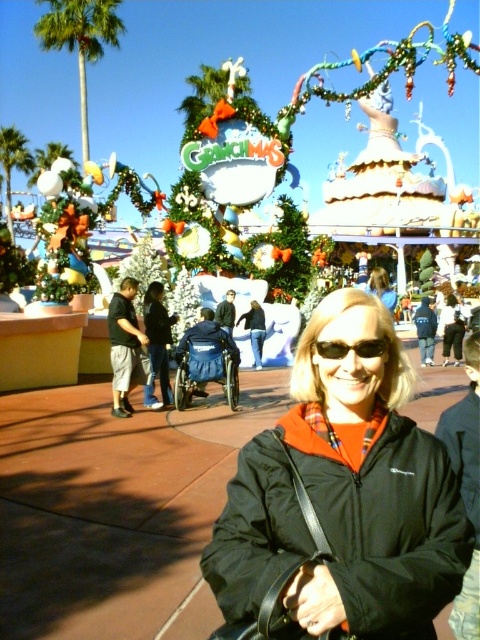
Is point (422, 538) more distant than point (383, 269)?

That is False.

Where is `black matte jacket at center`? The height and width of the screenshot is (640, 480). black matte jacket at center is located at coordinates (343, 497).

Which is below, black matte jacket at center or green leafy palm tree at upper left?

black matte jacket at center is below.

Between black matte jacket at center and green leafy palm tree at upper left, which one appears on the right side from the viewer's perspective?

black matte jacket at center is more to the right.

Where is `black matte jacket at center`? black matte jacket at center is located at coordinates (343, 497).

This screenshot has height=640, width=480. Find the location of `black matte jacket at center`. black matte jacket at center is located at coordinates (343, 497).

Consider the image. Can you confirm if green leafy palm tree at upper left is positioned to the right of black plastic sunglasses at center?

In fact, green leafy palm tree at upper left is to the left of black plastic sunglasses at center.

Is green leafy palm tree at upper left thinner than black plastic sunglasses at center?

In fact, green leafy palm tree at upper left might be wider than black plastic sunglasses at center.

Is point (86, 104) farther from camera compared to point (360, 356)?

Yes, it is behind point (360, 356).

This screenshot has width=480, height=640. In order to click on green leafy palm tree at upper left in this screenshot , I will do `click(80, 38)`.